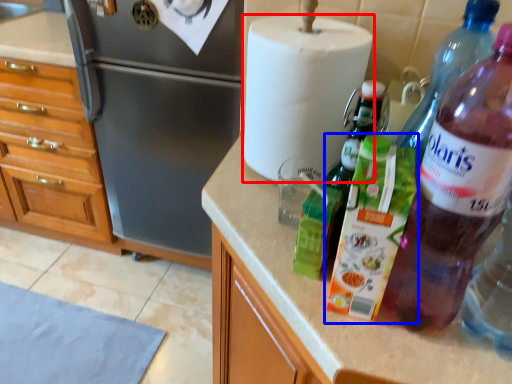
Question: Which object appears closest to the camera in this image, paper towel (highlighted by a red box) or bottle (highlighted by a blue box)?

Choices:
 (A) paper towel
 (B) bottle

Answer: (B)